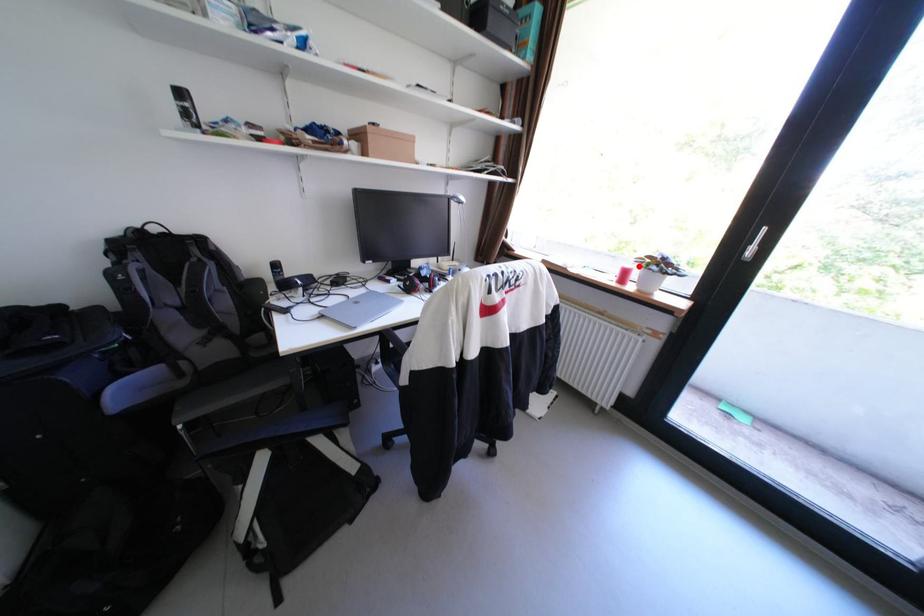
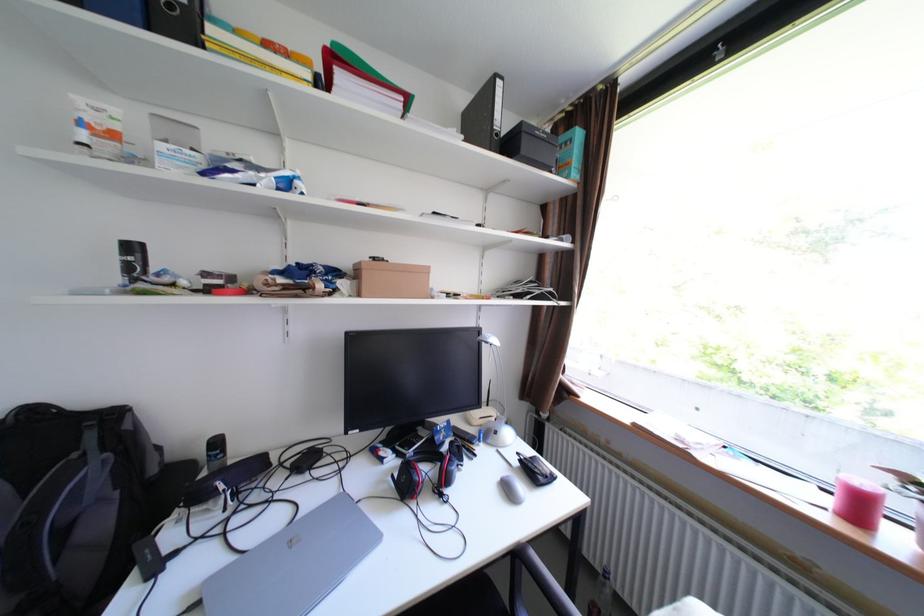
Locate, in the second image, the point that corresponds to the highlighted location in the first image.

(874, 484)